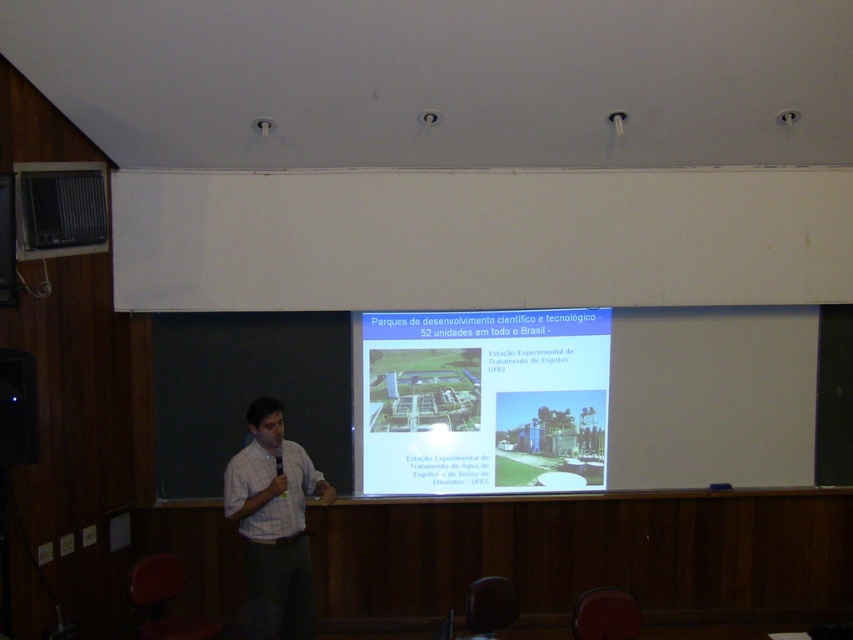
You are a student sitting in the classroom and need to locate the white matte projection screen at center for the presentation. Based on the coordinates provided, where exactly is the screen positioned in the image?

The white matte projection screen at center is located at point coordinates of 0.627 in the x axis and 0.566 in the y axis.

You are a student sitting at the back of the classroom. You notice two white objects in the center of the image. Which one is closer to you, the white matte projection screen at center or the white checkered shirt at center?

The white matte projection screen at center is closer to you because it is positioned further to the viewer than the white checkered shirt at center.

You are a student sitting in the classroom and want to know which object is taller between the white matte projection screen at center and the metallic projector at upper left. Can you tell me?

The white matte projection screen at center is much taller than the metallic projector at upper left.